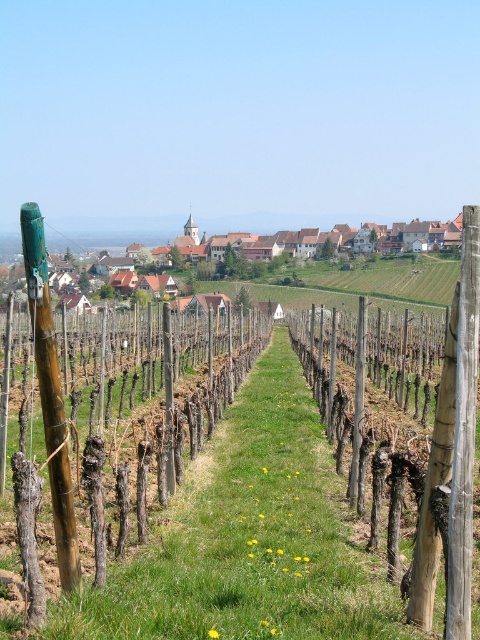
You are standing at the edge of the vineyard and see the wooden post at center and the brown wooden houses at center. Which object is closer to you?

The wooden post at center is closer to you since it is positioned in front of the brown wooden houses at center.